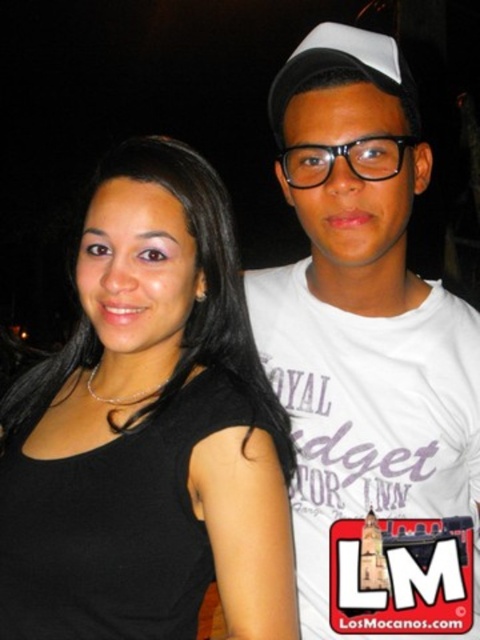
What do you see at coordinates (369, 356) in the screenshot?
I see `white cotton t-shirt at upper right` at bounding box center [369, 356].

Between point (261, 280) and point (233, 301), which one is positioned behind?

The point (261, 280) is behind.

The width and height of the screenshot is (480, 640). Find the location of `white cotton t-shirt at upper right`. white cotton t-shirt at upper right is located at coordinates (369, 356).

What do you see at coordinates (369, 356) in the screenshot? I see `white cotton t-shirt at upper right` at bounding box center [369, 356].

How much distance is there between white cotton t-shirt at upper right and white matte baseball cap at upper center?

A distance of 15.26 inches exists between white cotton t-shirt at upper right and white matte baseball cap at upper center.

Locate an element on the screen. This screenshot has width=480, height=640. white cotton t-shirt at upper right is located at coordinates (369, 356).

Identify the location of white cotton t-shirt at upper right. tap(369, 356).

Between black matte tank top at upper left and white matte baseball cap at upper center, which one appears on the left side from the viewer's perspective?

black matte tank top at upper left

Which is in front, point (128, 401) or point (393, 44)?

Point (393, 44) is more forward.

You are a GUI agent. You are given a task and a screenshot of the screen. Output one action in this format:
    pyautogui.click(x=<x>, y=<y>)
    Task: Click on the black matte tank top at upper left
    The height and width of the screenshot is (640, 480).
    Given the screenshot: What is the action you would take?
    pyautogui.click(x=170, y=371)